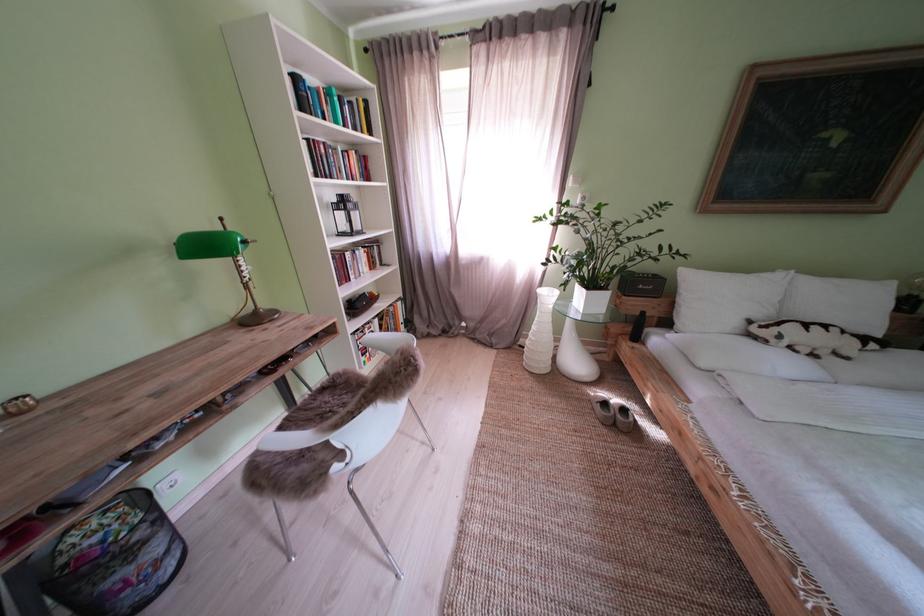
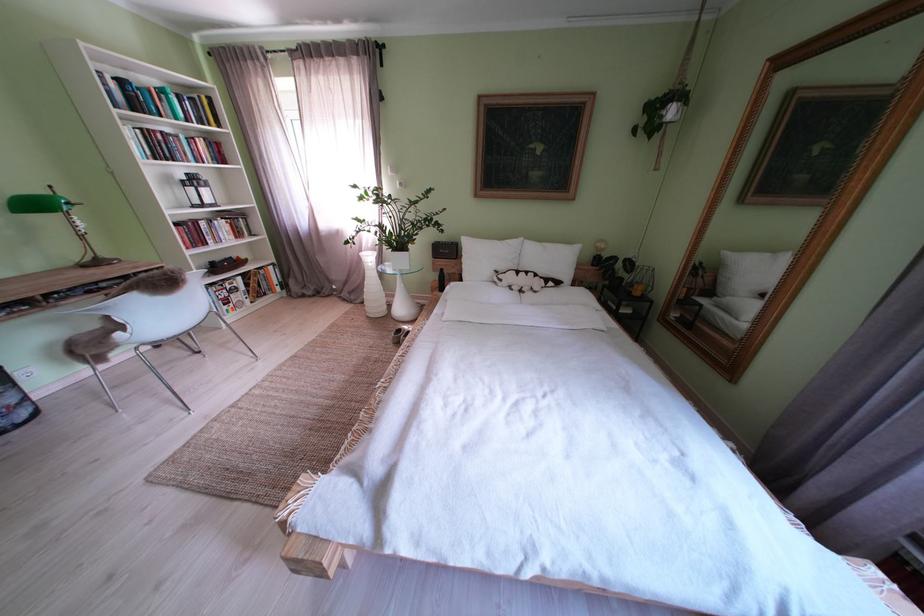
Find the pixel in the second image that matches [505,346] in the first image.

(363, 302)